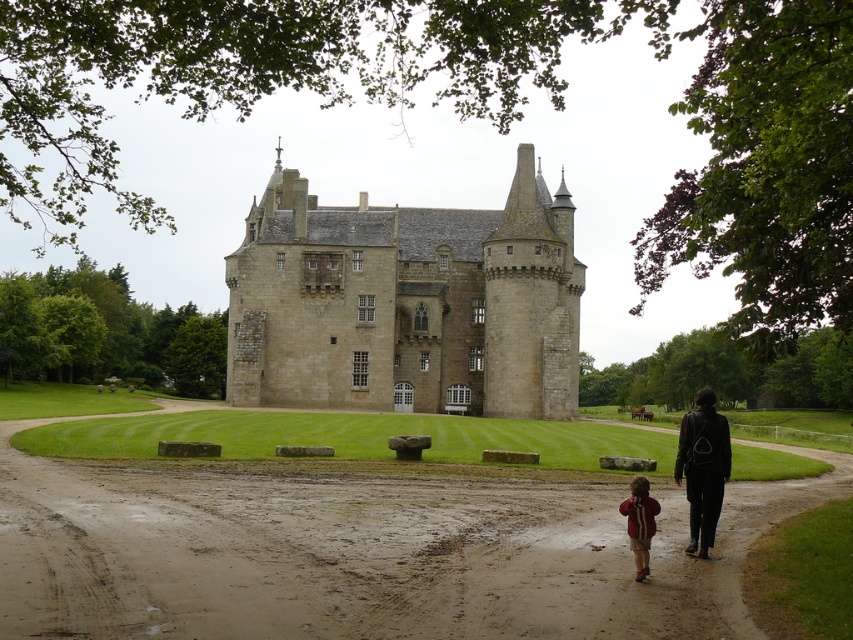
Question: Considering the relative positions of beige stone castle at center and red fleece jacket at lower right in the image provided, where is beige stone castle at center located with respect to red fleece jacket at lower right?

Choices:
 (A) above
 (B) below

Answer: (A)

Question: Among these objects, which one is nearest to the camera?

Choices:
 (A) brown dirt track at center
 (B) beige stone castle at center

Answer: (A)

Question: Is brown dirt track at center behind red fleece jacket at lower right?

Choices:
 (A) yes
 (B) no

Answer: (B)

Question: Which point is closer to the camera?

Choices:
 (A) (467, 618)
 (B) (408, 342)

Answer: (A)

Question: Does brown dirt track at center appear under beige stone castle at center?

Choices:
 (A) yes
 (B) no

Answer: (A)

Question: Considering the real-world distances, which object is closest to the red fleece jacket at lower right?

Choices:
 (A) brown dirt track at center
 (B) black leather jacket at lower right

Answer: (B)